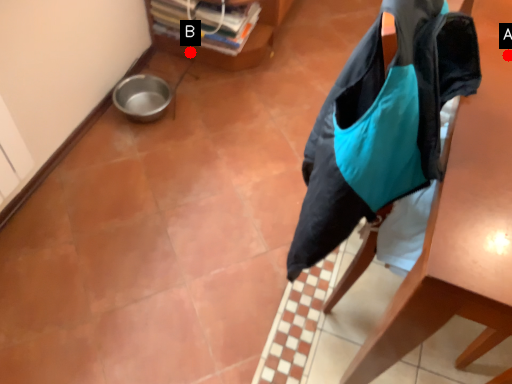
Question: Two points are circled on the image, labeled by A and B beside each circle. Which point is closer to the camera?

Choices:
 (A) A is closer
 (B) B is closer

Answer: (A)